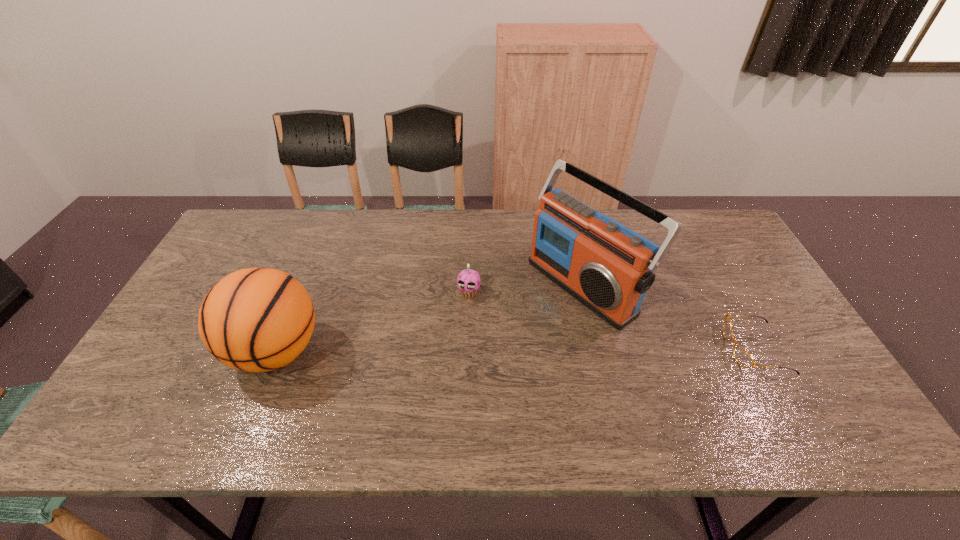
Locate an element on the screen. Image resolution: width=960 pixels, height=540 pixels. the third shortest object is located at coordinates (257, 319).

Find the location of `the leftmost object`. the leftmost object is located at coordinates (257, 319).

Identify the location of the rightmost object. (744, 359).

You are a GUI agent. You are given a task and a screenshot of the screen. Output one action in this format:
    pyautogui.click(x=<x>, y=<y>)
    Task: Click on the spectacles
    The image size is (960, 540).
    Given the screenshot: What is the action you would take?
    pyautogui.click(x=744, y=359)

At what (x,y) coordinates should I click in order to perform the action: click on radio receiver. Please return your answer as a coordinate pair (x, y). This screenshot has height=540, width=960. Looking at the image, I should click on (608, 267).

Locate an element on the screen. The height and width of the screenshot is (540, 960). the third object from left to right is located at coordinates (608, 267).

This screenshot has width=960, height=540. What are the coordinates of `cupcake` in the screenshot? It's located at (469, 278).

At what (x,y) coordinates should I click in order to perform the action: click on the second shortest object. Please return your answer as a coordinate pair (x, y). Looking at the image, I should click on (469, 278).

You are a GUI agent. You are given a task and a screenshot of the screen. Output one action in this format:
    pyautogui.click(x=<x>, y=<y>)
    Task: Click on the free region located 0.060m on the right of the third shortest object
    The image size is (960, 540).
    Given the screenshot: What is the action you would take?
    pyautogui.click(x=347, y=351)

Where is `free point located on the front-facing side of the shortest object`? The height and width of the screenshot is (540, 960). free point located on the front-facing side of the shortest object is located at coordinates (605, 349).